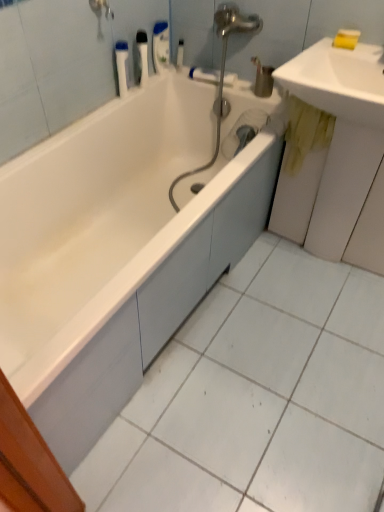
Question: Is yellow stained wood at right closer to camera compared to white glossy sink at upper right?

Choices:
 (A) no
 (B) yes

Answer: (A)

Question: Is yellow stained wood at right oriented away from white glossy sink at upper right?

Choices:
 (A) yes
 (B) no

Answer: (B)

Question: Is yellow stained wood at right wider than white glossy sink at upper right?

Choices:
 (A) no
 (B) yes

Answer: (A)

Question: Can you confirm if yellow stained wood at right is thinner than white glossy sink at upper right?

Choices:
 (A) yes
 (B) no

Answer: (A)

Question: From a real-world perspective, is yellow stained wood at right physically above white glossy sink at upper right?

Choices:
 (A) no
 (B) yes

Answer: (A)

Question: Could you tell me if yellow stained wood at right is turned towards white glossy sink at upper right?

Choices:
 (A) yes
 (B) no

Answer: (B)

Question: Does white plastic container at upper left, the fourth toiletry when ordered from right to left, turn towards white plastic bottle at upper center, which is counted as the 1th toiletry, starting from the right?

Choices:
 (A) no
 (B) yes

Answer: (A)

Question: Considering the relative sizes of white plastic container at upper left, the fourth toiletry when ordered from right to left, and white plastic bottle at upper center, which is counted as the 1th toiletry, starting from the right, in the image provided, is white plastic container at upper left, the fourth toiletry when ordered from right to left, bigger than white plastic bottle at upper center, which is counted as the 1th toiletry, starting from the right,?

Choices:
 (A) yes
 (B) no

Answer: (A)

Question: From a real-world perspective, is white plastic container at upper left, the fourth toiletry when ordered from right to left, on top of white plastic bottle at upper center, the 4th toiletry positioned from the left?

Choices:
 (A) no
 (B) yes

Answer: (B)

Question: Considering the relative sizes of white plastic container at upper left, which is the 1th toiletry in left-to-right order, and white plastic bottle at upper center, the 4th toiletry positioned from the left, in the image provided, is white plastic container at upper left, which is the 1th toiletry in left-to-right order, shorter than white plastic bottle at upper center, the 4th toiletry positioned from the left,?

Choices:
 (A) no
 (B) yes

Answer: (A)

Question: Considering the relative sizes of white plastic container at upper left, the fourth toiletry when ordered from right to left, and white plastic bottle at upper center, the 4th toiletry positioned from the left, in the image provided, is white plastic container at upper left, the fourth toiletry when ordered from right to left, thinner than white plastic bottle at upper center, the 4th toiletry positioned from the left,?

Choices:
 (A) no
 (B) yes

Answer: (A)

Question: From the image's perspective, is white plastic container at upper left, which is the 1th toiletry in left-to-right order, on white plastic bottle at upper center, the 4th toiletry positioned from the left?

Choices:
 (A) yes
 (B) no

Answer: (B)

Question: Is white plastic bottle at upper center, which is counted as the 3th toiletry, starting from the left, at the right side of yellow stained wood at right?

Choices:
 (A) no
 (B) yes

Answer: (A)